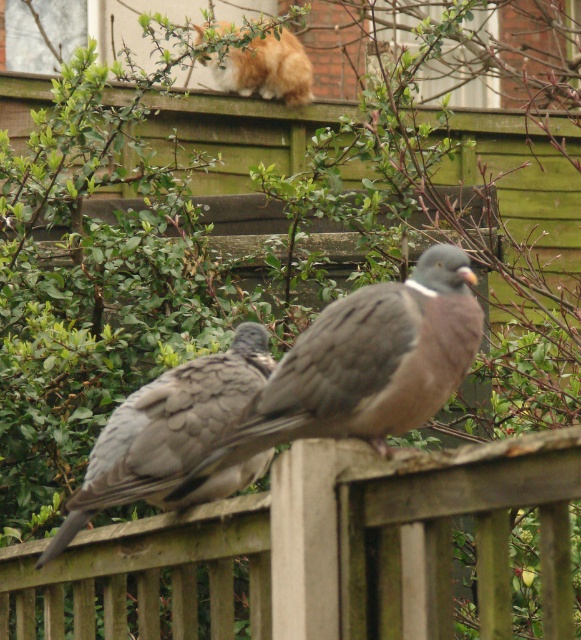
Is point (69, 508) positioned before point (279, 84)?

Yes, point (69, 508) is in front of point (279, 84).

What do you see at coordinates (171, 435) in the screenshot?
I see `gray speckled pigeon at center` at bounding box center [171, 435].

Does point (148, 424) come farther from viewer compared to point (306, 99)?

No, (148, 424) is in front of (306, 99).

Where is `gray speckled pigeon at center`? The image size is (581, 640). gray speckled pigeon at center is located at coordinates (171, 435).

Who is shorter, wooden fence at center or orange and white fur cat at upper center?

Standing shorter between the two is orange and white fur cat at upper center.

Is point (352, 516) positioned behind point (243, 93)?

That is False.

Identify the location of wooden fence at center. Image resolution: width=581 pixels, height=640 pixels. (327, 547).

Who is positioned more to the left, wooden fence at center or gray speckled pigeon at center?

Positioned to the left is gray speckled pigeon at center.

Is wooden fence at center bigger than gray speckled pigeon at center?

Correct, wooden fence at center is larger in size than gray speckled pigeon at center.

Identify the location of wooden fence at center. This screenshot has width=581, height=640. (327, 547).